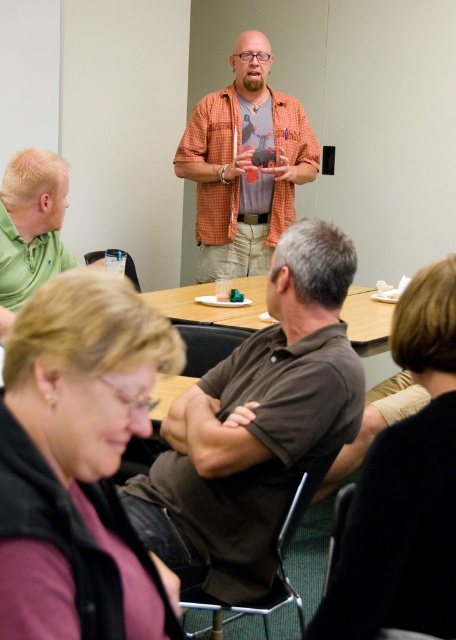
Question: Which object appears farthest from the camera in this image?

Choices:
 (A) wooden table at center
 (B) orange checkered shirt at center
 (C) green matte shirt at lower left
 (D) brown cotton shirt at center

Answer: (B)

Question: Can you confirm if orange checkered shirt at center is thinner than green matte shirt at lower left?

Choices:
 (A) yes
 (B) no

Answer: (B)

Question: Is brown cotton shirt at center below orange checkered shirt at center?

Choices:
 (A) no
 (B) yes

Answer: (B)

Question: Does brown cotton shirt at center have a larger size compared to green matte shirt at lower left?

Choices:
 (A) yes
 (B) no

Answer: (A)

Question: Which object is the closest to the green matte shirt at lower left?

Choices:
 (A) orange checkered shirt at center
 (B) brown cotton shirt at center

Answer: (B)

Question: Which point is closer to the camera?

Choices:
 (A) (187, 310)
 (B) (262, 202)
 (C) (238, 467)

Answer: (C)